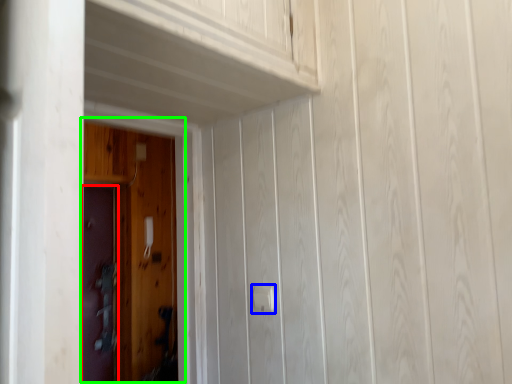
Question: Considering the real-world distances, which object is closest to door (highlighted by a red box)? door handle (highlighted by a blue box) or door (highlighted by a green box).

Choices:
 (A) door handle
 (B) door

Answer: (B)